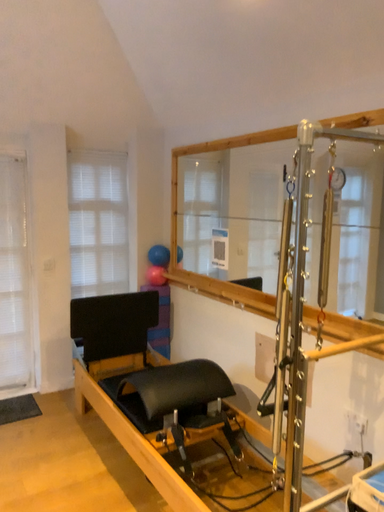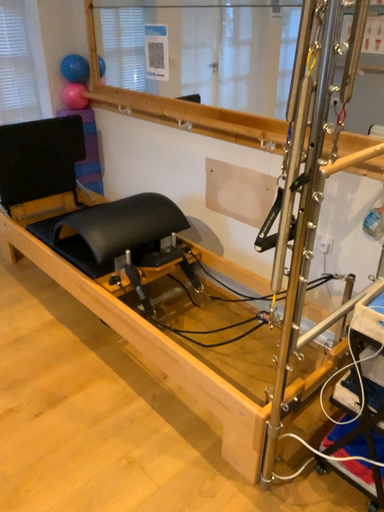
Question: Which way did the camera rotate in the video?

Choices:
 (A) rotated left
 (B) rotated right

Answer: (B)